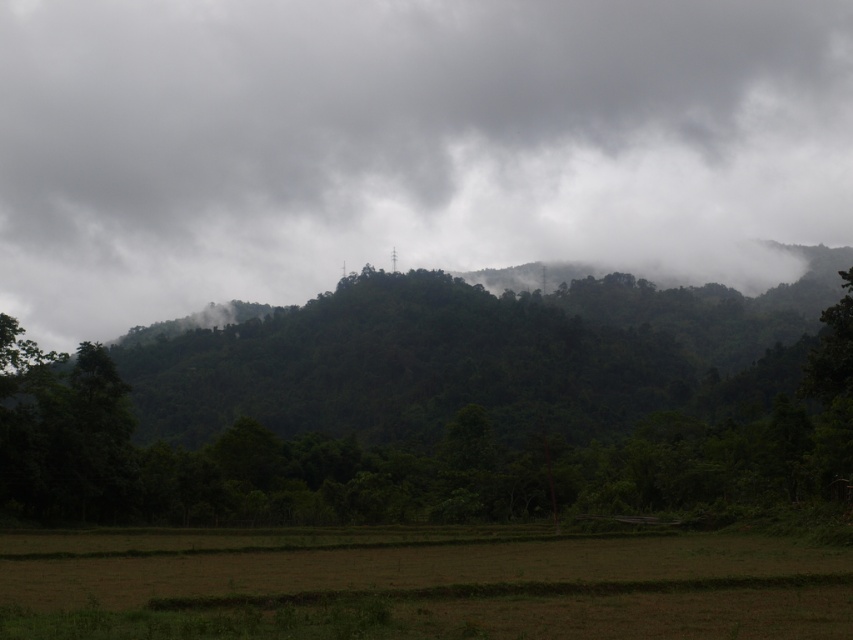
Question: Can you confirm if white fluffy cloud at upper center is positioned to the left of brown grassland at lower center?

Choices:
 (A) no
 (B) yes

Answer: (A)

Question: Which object is the closest to the green leafy tree at center?

Choices:
 (A) white fluffy cloud at upper center
 (B) brown grassland at lower center

Answer: (B)

Question: Which is nearer to the green leafy tree at center?

Choices:
 (A) white fluffy cloud at upper center
 (B) brown grassland at lower center

Answer: (B)

Question: Among these points, which one is nearest to the camera?

Choices:
 (A) (80, 483)
 (B) (415, 561)
 (C) (457, 56)

Answer: (B)

Question: In this image, where is white fluffy cloud at upper center located relative to brown grassland at lower center?

Choices:
 (A) above
 (B) below

Answer: (A)

Question: Observing the image, what is the correct spatial positioning of white fluffy cloud at upper center in reference to green leafy tree at center?

Choices:
 (A) left
 (B) right

Answer: (B)